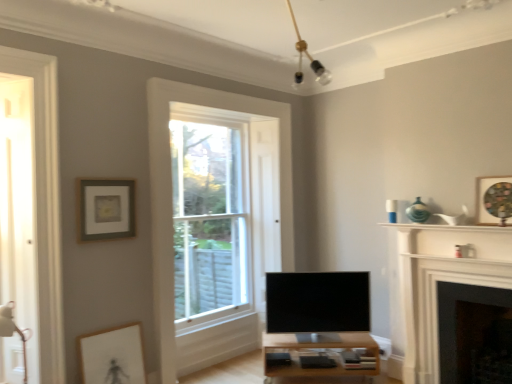
Where is `light wood table at center`? This screenshot has width=512, height=384. light wood table at center is located at coordinates (320, 356).

In order to face light wood table at center, should I rotate leftwards or rightwards?

Turn right by 8.190 degrees to look at light wood table at center.

The width and height of the screenshot is (512, 384). Find the location of `clear glass window at center`. clear glass window at center is located at coordinates (210, 214).

Where is `wooden textured picture frame at upper right, which ranks as the 1th picture frame in right-to-left order`? The width and height of the screenshot is (512, 384). wooden textured picture frame at upper right, which ranks as the 1th picture frame in right-to-left order is located at coordinates (493, 199).

At what (x,y) coordinates should I click in order to perform the action: click on silver metallic tv at center. Please return your answer as a coordinate pair (x, y). The width and height of the screenshot is (512, 384). Looking at the image, I should click on (317, 301).

Is silver metallic tv at center a part of white glossy shelf at upper right?

No, silver metallic tv at center is not a part of white glossy shelf at upper right.

Where is `shelf located on the right of silver metallic tv at center`? shelf located on the right of silver metallic tv at center is located at coordinates (448, 227).

Considering the relative positions of white glossy shelf at upper right and silver metallic tv at center in the image provided, is white glossy shelf at upper right to the right of silver metallic tv at center from the viewer's perspective?

Correct, you'll find white glossy shelf at upper right to the right of silver metallic tv at center.

From the image's perspective, which object appears higher, wooden textured picture frame at upper right, which ranks as the 3th picture frame in left-to-right order, or silver metallic tv at center?

wooden textured picture frame at upper right, which ranks as the 3th picture frame in left-to-right order.

Is wooden textured picture frame at upper right, which ranks as the 3th picture frame in left-to-right order, placed right next to silver metallic tv at center?

No, wooden textured picture frame at upper right, which ranks as the 3th picture frame in left-to-right order, is not in contact with silver metallic tv at center.

Considering the sizes of objects wooden textured picture frame at upper right, which ranks as the 3th picture frame in left-to-right order, and silver metallic tv at center in the image provided, who is bigger, wooden textured picture frame at upper right, which ranks as the 3th picture frame in left-to-right order, or silver metallic tv at center?

Bigger between the two is silver metallic tv at center.

Considering the points (447, 256) and (484, 377), which point is behind, point (447, 256) or point (484, 377)?

The point (447, 256) is behind.

Is white wood fireplace at right, acting as the first fireplace starting from the left, to the left of dark gray stone fireplace at lower right, which is counted as the first fireplace, starting from the right, from the viewer's perspective?

Correct, you'll find white wood fireplace at right, acting as the first fireplace starting from the left, to the left of dark gray stone fireplace at lower right, which is counted as the first fireplace, starting from the right.

Can you confirm if white wood fireplace at right, acting as the first fireplace starting from the left, is smaller than dark gray stone fireplace at lower right, which is counted as the first fireplace, starting from the right?

No, white wood fireplace at right, acting as the first fireplace starting from the left, is not smaller than dark gray stone fireplace at lower right, which is counted as the first fireplace, starting from the right.

Between clear glass window at center and matte white picture frame at lower left, the 2th picture frame when ordered from right to left, which one has smaller width?

matte white picture frame at lower left, the 2th picture frame when ordered from right to left.

Considering the points (228, 171) and (86, 335), which point is in front, point (228, 171) or point (86, 335)?

Positioned in front is point (86, 335).

Considering the positions of objects clear glass window at center and matte white picture frame at lower left, which is the 2th picture frame from left to right, in the image provided, who is behind, clear glass window at center or matte white picture frame at lower left, which is the 2th picture frame from left to right,?

clear glass window at center is behind.

From a real-world perspective, is clear glass window at center physically above matte white picture frame at lower left, the 1th picture frame in the bottom-to-top sequence?

Yes, from a real-world perspective, clear glass window at center is on top of matte white picture frame at lower left, the 1th picture frame in the bottom-to-top sequence.

Is wooden textured picture frame at upper right, which is the first picture frame in top-to-bottom order, not close to dark gray stone fireplace at lower right, which is counted as the first fireplace, starting from the right?

They are positioned close to each other.

Is wooden textured picture frame at upper right, which is the first picture frame in top-to-bottom order, oriented away from dark gray stone fireplace at lower right, the 2th fireplace when ordered from left to right?

wooden textured picture frame at upper right, which is the first picture frame in top-to-bottom order, does not have its back to dark gray stone fireplace at lower right, the 2th fireplace when ordered from left to right.

Can you confirm if wooden textured picture frame at upper right, which ranks as the 3th picture frame in left-to-right order, is taller than dark gray stone fireplace at lower right, which is counted as the first fireplace, starting from the right?

No.

Consider the image. Does clear glass window at center contain white wood fireplace at right, the 2th fireplace positioned from the right?

No.

Relative to white wood fireplace at right, acting as the first fireplace starting from the left, is clear glass window at center in front or behind?

Visually, clear glass window at center is located behind white wood fireplace at right, acting as the first fireplace starting from the left.

Image resolution: width=512 pixels, height=384 pixels. In order to click on bay window above the white wood fireplace at right, acting as the first fireplace starting from the left (from the image's perspective) in this screenshot , I will do `click(210, 214)`.

Can you tell me how much clear glass window at center and white wood fireplace at right, acting as the first fireplace starting from the left, differ in facing direction?

clear glass window at center and white wood fireplace at right, acting as the first fireplace starting from the left, are facing 89.7 degrees away from each other.

In the image, is light wood table at center on the left side or the right side of wooden textured picture frame at upper right, which ranks as the 3th picture frame in left-to-right order?

From the image, it's evident that light wood table at center is to the left of wooden textured picture frame at upper right, which ranks as the 3th picture frame in left-to-right order.

Is light wood table at center not near wooden textured picture frame at upper right, which ranks as the 3th picture frame in left-to-right order?

light wood table at center is positioned a significant distance from wooden textured picture frame at upper right, which ranks as the 3th picture frame in left-to-right order.

Which is behind, point (373, 371) or point (499, 186)?

The point (373, 371) is farther.

Is light wood table at center facing away from wooden textured picture frame at upper right, the 3th picture frame positioned from the bottom?

No, wooden textured picture frame at upper right, the 3th picture frame positioned from the bottom, is not at the back of light wood table at center.

Locate an element on the screen. Image resolution: width=512 pixels, height=384 pixels. shelf in front of the silver metallic tv at center is located at coordinates (448, 227).

Locate an element on the screen. The height and width of the screenshot is (384, 512). picture frame that is the 2nd one when counting upward from the silver metallic tv at center (from the image's perspective) is located at coordinates (493, 199).

Looking at the image, which one is located further to light wood table at center, white wood fireplace at right, the 2th fireplace positioned from the right, or dark gray stone fireplace at lower right, which is counted as the first fireplace, starting from the right?

Based on the image, dark gray stone fireplace at lower right, which is counted as the first fireplace, starting from the right, appears to be further to light wood table at center.

Considering their positions, is matte gray picture frame at upper left, which appears as the third picture frame when viewed from the right, positioned closer to wooden textured picture frame at upper right, which ranks as the 3th picture frame in left-to-right order, than silver metallic tv at center?

The object closer to wooden textured picture frame at upper right, which ranks as the 3th picture frame in left-to-right order, is silver metallic tv at center.

From the image, which object appears to be farther from white glossy shelf at upper right, matte white picture frame at lower left, which is the 3th picture frame in top-to-bottom order, or dark gray stone fireplace at lower right, the 2th fireplace when ordered from left to right?

Among the two, matte white picture frame at lower left, which is the 3th picture frame in top-to-bottom order, is located further to white glossy shelf at upper right.

Based on their spatial positions, is clear glass window at center or white glossy shelf at upper right further from light wood table at center?

Based on the image, clear glass window at center appears to be further to light wood table at center.

Based on their spatial positions, is dark gray stone fireplace at lower right, the 2th fireplace when ordered from left to right, or white wood fireplace at right, acting as the first fireplace starting from the left, closer to clear glass window at center?

white wood fireplace at right, acting as the first fireplace starting from the left, lies closer to clear glass window at center than the other object.

From the picture: From the image, which object appears to be farther from white wood fireplace at right, the 2th fireplace positioned from the right, silver metallic tv at center or dark gray stone fireplace at lower right, which is counted as the first fireplace, starting from the right?

silver metallic tv at center is further to white wood fireplace at right, the 2th fireplace positioned from the right.

Based on their spatial positions, is light wood table at center or white glossy shelf at upper right closer to dark gray stone fireplace at lower right, which is counted as the first fireplace, starting from the right?

Based on the image, white glossy shelf at upper right appears to be nearer to dark gray stone fireplace at lower right, which is counted as the first fireplace, starting from the right.

Based on the photo, estimate the real-world distances between objects in this image. Which object is closer to matte gray picture frame at upper left, arranged as the 2th picture frame when viewed from the top, clear glass window at center or wooden textured picture frame at upper right, the 3th picture frame positioned from the bottom?

The object closer to matte gray picture frame at upper left, arranged as the 2th picture frame when viewed from the top, is clear glass window at center.

Where is `bay window between matte white picture frame at lower left, which is the 2th picture frame from left to right, and wooden textured picture frame at upper right, which is the first picture frame in top-to-bottom order, from left to right`? The image size is (512, 384). bay window between matte white picture frame at lower left, which is the 2th picture frame from left to right, and wooden textured picture frame at upper right, which is the first picture frame in top-to-bottom order, from left to right is located at coordinates (210, 214).

You are a GUI agent. You are given a task and a screenshot of the screen. Output one action in this format:
    pyautogui.click(x=<x>, y=<y>)
    Task: Click on the television between matte gray picture frame at upper left, the 2th picture frame positioned from the bottom, and dark gray stone fireplace at lower right, the 2th fireplace when ordered from left to right
    
    Given the screenshot: What is the action you would take?
    pyautogui.click(x=317, y=301)

I want to click on table between matte white picture frame at lower left, which is the 2th picture frame from left to right, and dark gray stone fireplace at lower right, which is counted as the first fireplace, starting from the right, from left to right, so click(320, 356).

Where is `table between clear glass window at center and white glossy shelf at upper right in the horizontal direction`? table between clear glass window at center and white glossy shelf at upper right in the horizontal direction is located at coordinates (320, 356).